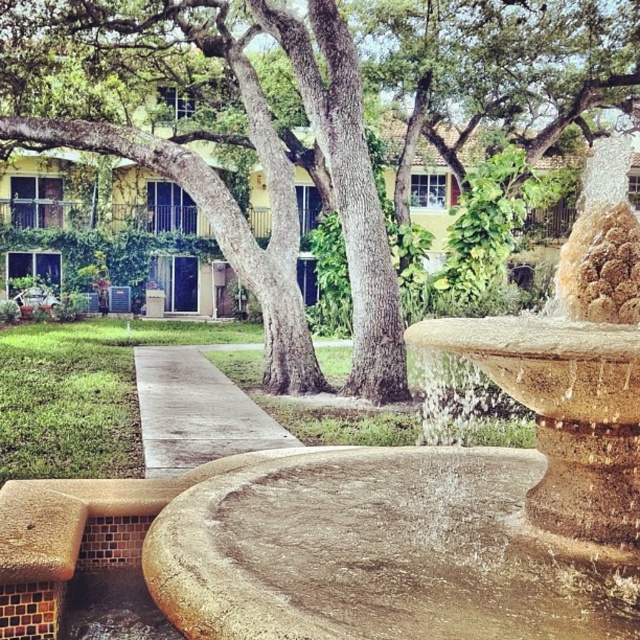
Question: Which of the following is the farthest from the observer?

Choices:
 (A) concrete at center
 (B) stone fountain at center
 (C) green textured tree at center

Answer: (C)

Question: Among these points, which one is farthest from the camera?

Choices:
 (A) (182, 440)
 (B) (412, 500)
 (C) (400, 340)

Answer: (C)

Question: Can you confirm if green textured tree at center is positioned below concrete at center?

Choices:
 (A) no
 (B) yes

Answer: (A)

Question: Is stone fountain at center to the right of concrete at center from the viewer's perspective?

Choices:
 (A) no
 (B) yes

Answer: (B)

Question: Does stone fountain at center have a larger size compared to concrete at center?

Choices:
 (A) yes
 (B) no

Answer: (A)

Question: Which of these objects is positioned farthest from the concrete at center?

Choices:
 (A) stone fountain at center
 (B) green textured tree at center

Answer: (A)